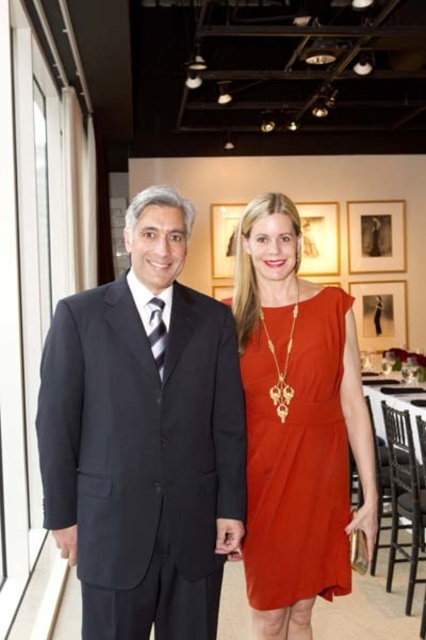
You are organizing a charity event and need to arrange seating for two guests wearing the black suit at left and the matte orange dress at center. If the chairs available are standard size, will both guests fit comfortably?

The black suit at left has a larger size compared to the matte orange dress at center. Since the chairs are standard size, the guest in the black suit at left may require more space and might not fit comfortably in a standard chair, while the guest in the matte orange dress at center should fit comfortably.

You are a photographer at a formal event. You want to capture a photo of the black suit at left and the matte orange dress at center. Based on their positions, which object is closer to the camera?

The black suit at left is positioned over the matte orange dress at center, meaning it is closer to the camera.

You are a photographer at a formal event. You need to position the black suit at left and matte orange dress at center in your frame. Which one should you focus on first if you want to capture their full height in the photo?

The black suit at left has a greater height compared to the matte orange dress at center, so you should focus on the black suit at left first to ensure its full height is captured in the photo.